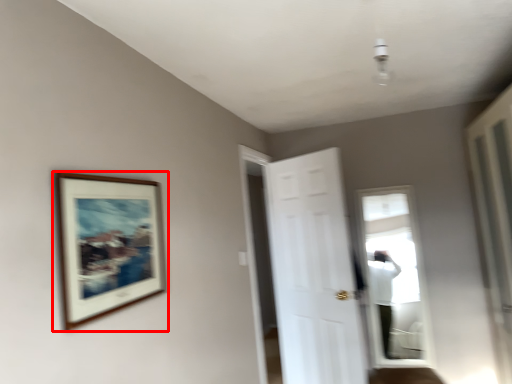
Question: From the image's perspective, considering the relative positions of picture frame (annotated by the red box) and door in the image provided, where is picture frame (annotated by the red box) located with respect to the staircase?

Choices:
 (A) below
 (B) above

Answer: (B)